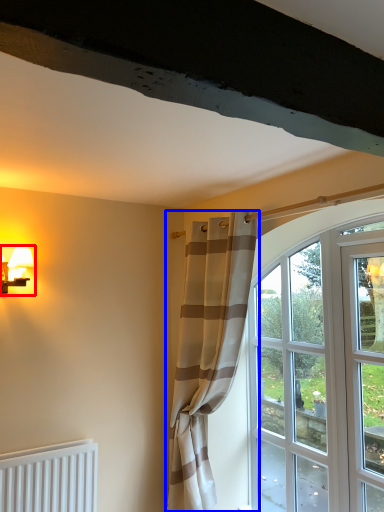
Question: Which of the following is the farthest to the observer, table lamp (highlighted by a red box) or curtain (highlighted by a blue box)?

Choices:
 (A) table lamp
 (B) curtain

Answer: (A)